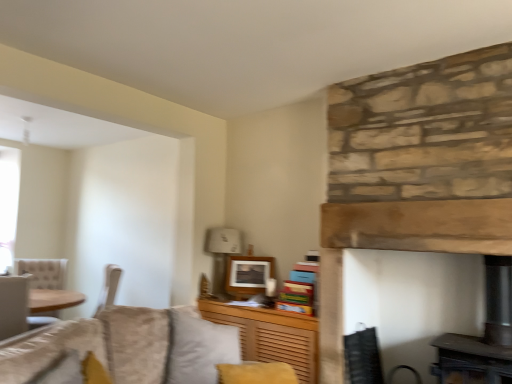
Question: From their relative heights in the image, would you say white fabric lampshade at upper center is taller or shorter than natural stone fireplace at center?

Choices:
 (A) tall
 (B) short

Answer: (B)

Question: Based on their sizes in the image, would you say white fabric lampshade at upper center is bigger or smaller than natural stone fireplace at center?

Choices:
 (A) big
 (B) small

Answer: (B)

Question: Based on their relative distances, which object is nearer to the velvet gray pillow at center?

Choices:
 (A) natural stone fireplace at center
 (B) black mesh swivel chair at lower right
 (C) matte white picture frame at upper center
 (D) wooden cabinet at lower center
 (E) white fabric lampshade at upper center

Answer: (D)

Question: Considering the real-world distances, which object is farthest from the natural stone fireplace at center?

Choices:
 (A) white fabric lampshade at upper center
 (B) matte white picture frame at upper center
 (C) black mesh swivel chair at lower right
 (D) velvet gray pillow at center
 (E) wooden cabinet at lower center

Answer: (A)